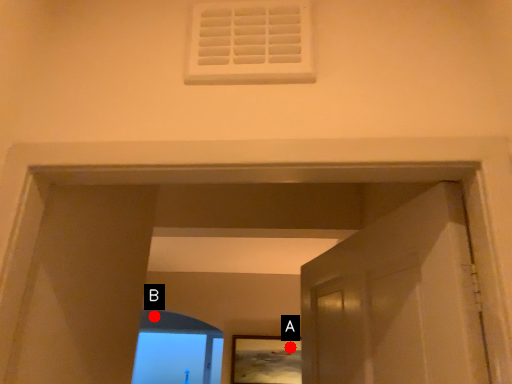
Question: Two points are circled on the image, labeled by A and B beside each circle. Which point appears farthest from the camera in this image?

Choices:
 (A) A is further
 (B) B is further

Answer: (B)